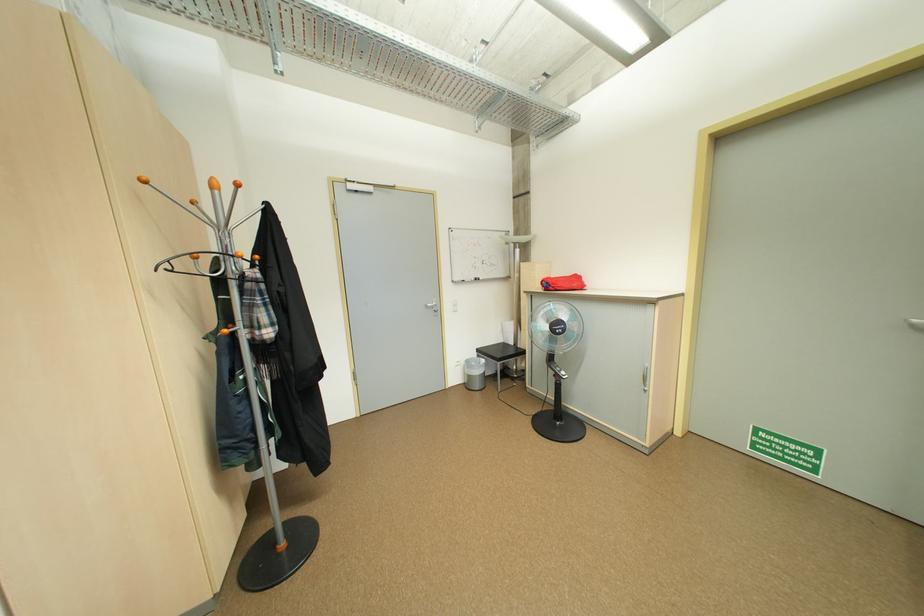
What do you see at coordinates (558, 371) in the screenshot?
I see `a fan control button` at bounding box center [558, 371].